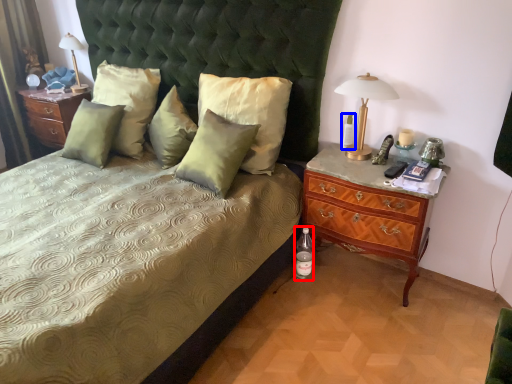
Question: Which point is closer to the camera, bottle (highlighted by a red box) or bottle (highlighted by a blue box)?

Choices:
 (A) bottle
 (B) bottle

Answer: (B)